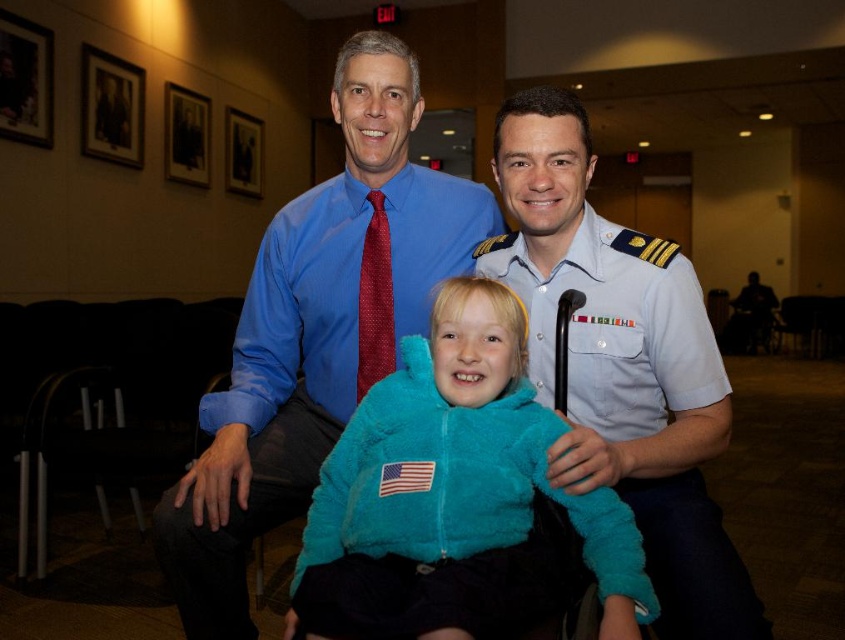
Is blue shirt at center further to camera compared to turquoise fuzzy jacket at center?

Yes, blue shirt at center is further from the viewer.

Can you confirm if blue shirt at center is positioned to the left of turquoise fuzzy jacket at center?

Correct, you'll find blue shirt at center to the left of turquoise fuzzy jacket at center.

What do you see at coordinates (312, 333) in the screenshot?
I see `blue shirt at center` at bounding box center [312, 333].

What are the coordinates of `blue shirt at center` in the screenshot? It's located at (312, 333).

Does light blue uniform at center have a smaller size compared to red dotted tie at center?

No, light blue uniform at center is not smaller than red dotted tie at center.

How distant is light blue uniform at center from red dotted tie at center?

18.69 inches

Find the location of a particular element. Image resolution: width=845 pixels, height=640 pixels. light blue uniform at center is located at coordinates (620, 364).

Is turquoise fuzzy jacket at center behind red dotted tie at center?

No, turquoise fuzzy jacket at center is closer to the viewer.

Does turquoise fuzzy jacket at center appear on the right side of red dotted tie at center?

Indeed, turquoise fuzzy jacket at center is positioned on the right side of red dotted tie at center.

Is point (393, 448) more distant than point (368, 364)?

No, it is in front of (368, 364).

Where is `turquoise fuzzy jacket at center`? turquoise fuzzy jacket at center is located at coordinates [453, 493].